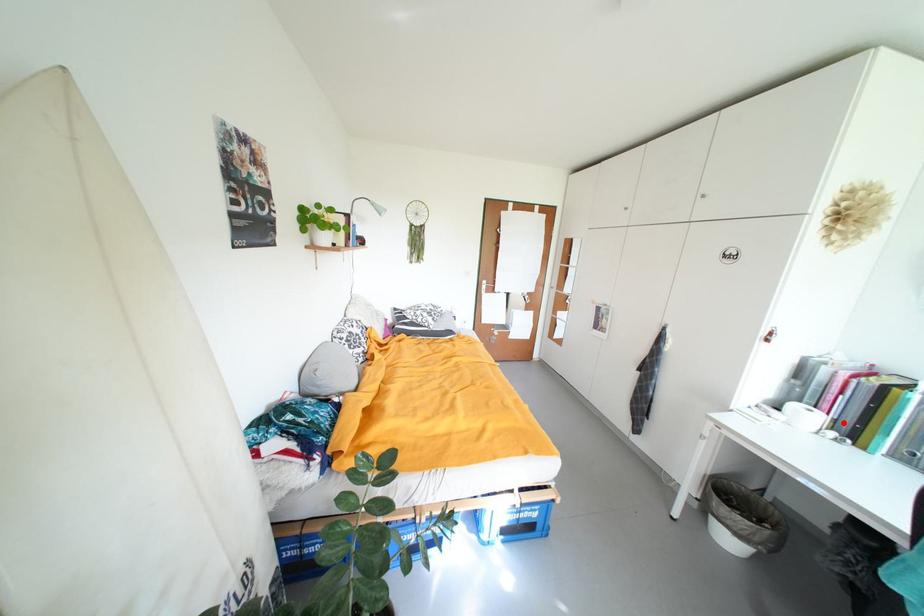
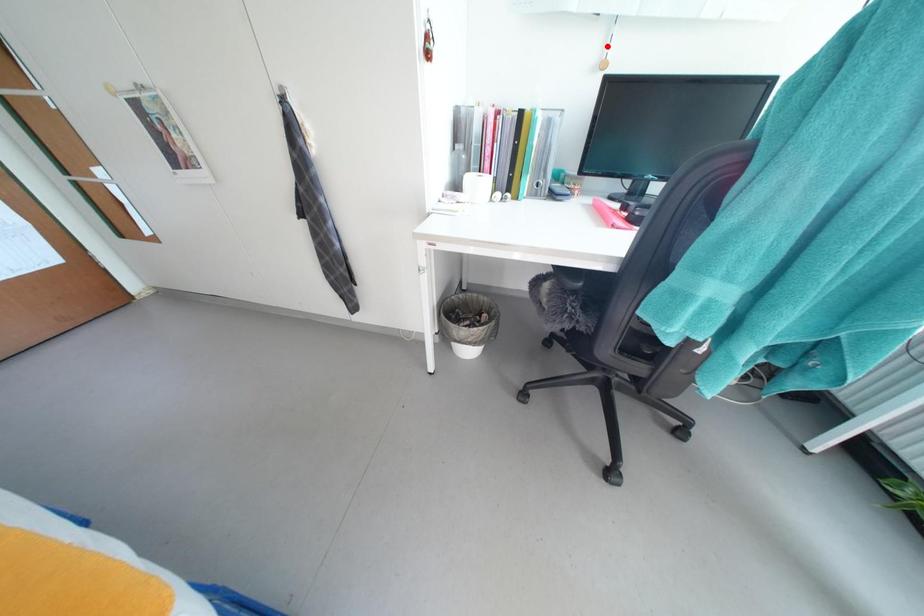
I am providing you with two images of the same scene from different viewpoints. A red point is marked on the first image and another point is marked on the second image. Does the point marked in image1 correspond to the same location as the one in image2?

No